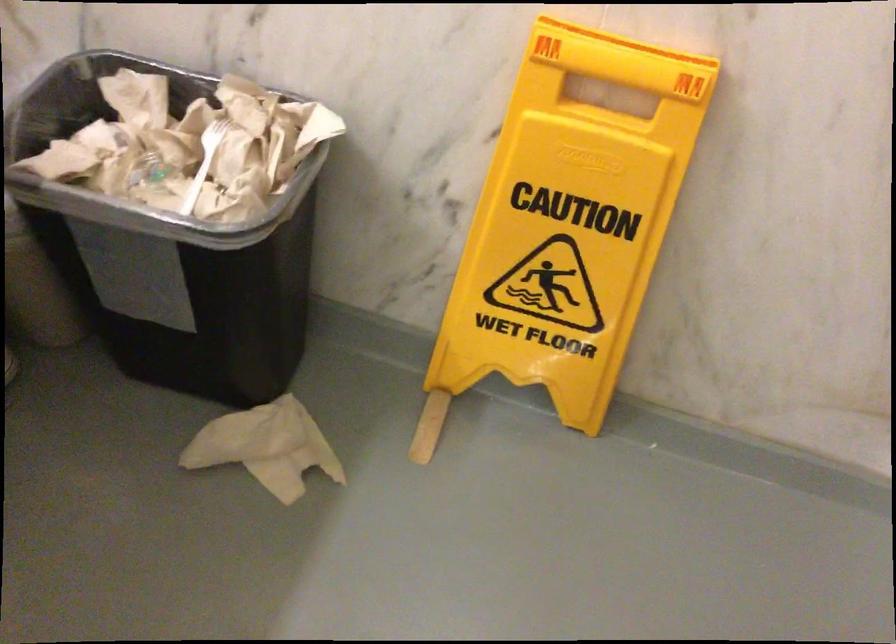
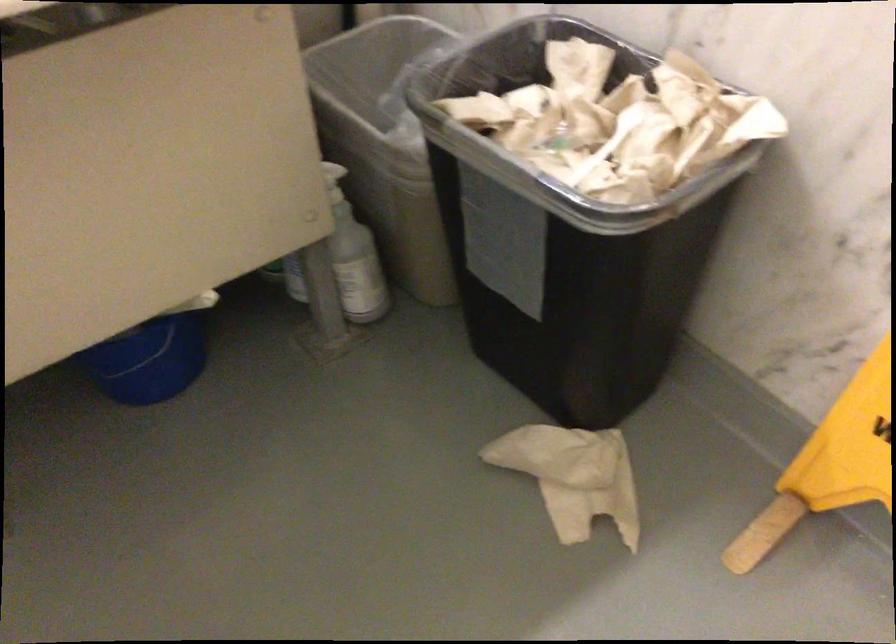
Find the pixel in the second image that matches pixel 211 145 in the first image.

(618, 122)